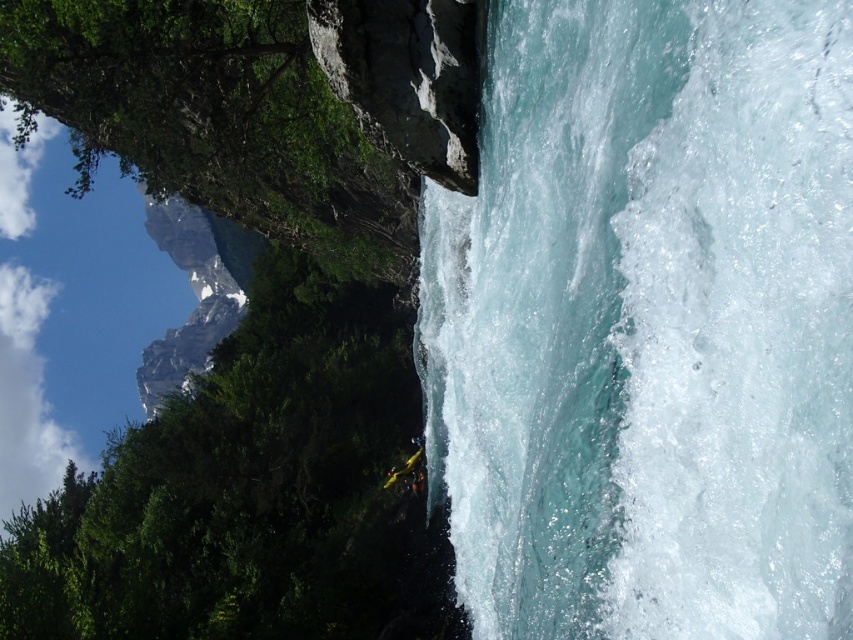
Question: Which object appears closest to the camera in this image?

Choices:
 (A) yellow plastic kayak at lower center
 (B) clear water at center

Answer: (B)

Question: Among these points, which one is nearest to the camera?

Choices:
 (A) (830, 545)
 (B) (416, 436)

Answer: (A)

Question: Observing the image, what is the correct spatial positioning of clear water at center in reference to yellow plastic kayak at lower center?

Choices:
 (A) below
 (B) above

Answer: (B)

Question: Can you confirm if clear water at center is positioned below yellow plastic kayak at lower center?

Choices:
 (A) yes
 (B) no

Answer: (B)

Question: Is clear water at center below yellow plastic kayak at lower center?

Choices:
 (A) yes
 (B) no

Answer: (B)